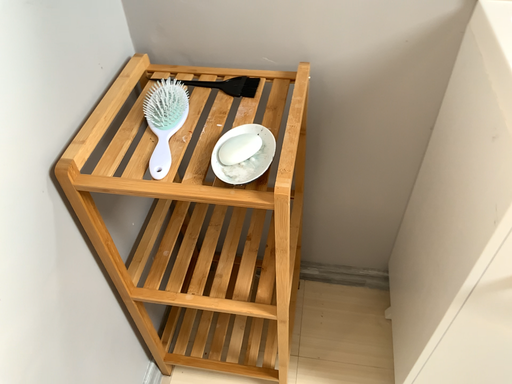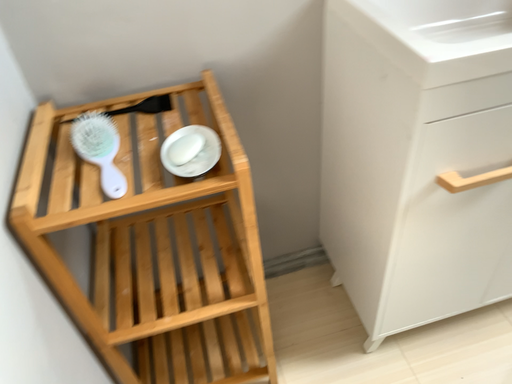
Question: Which way did the camera rotate in the video?

Choices:
 (A) rotated downward
 (B) rotated upward

Answer: (B)